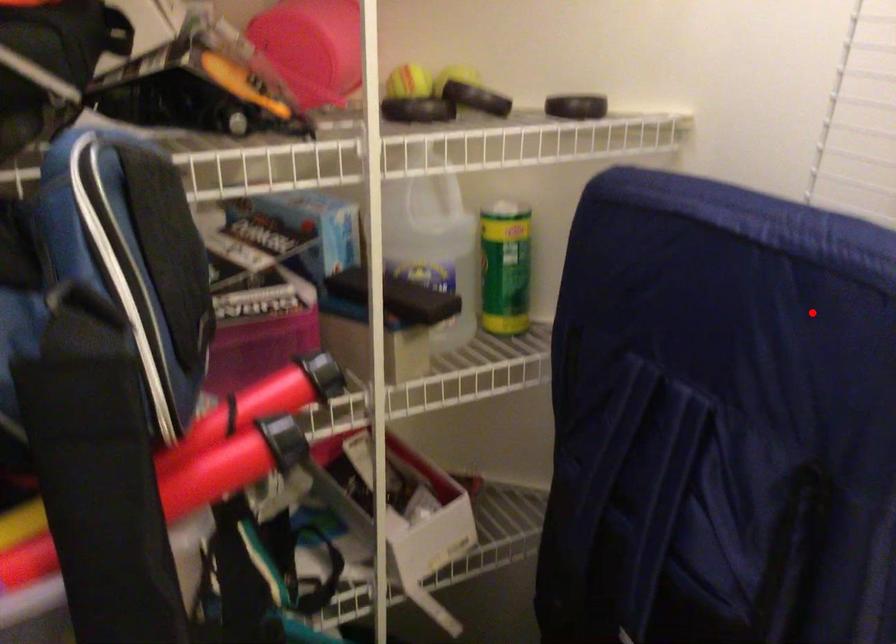
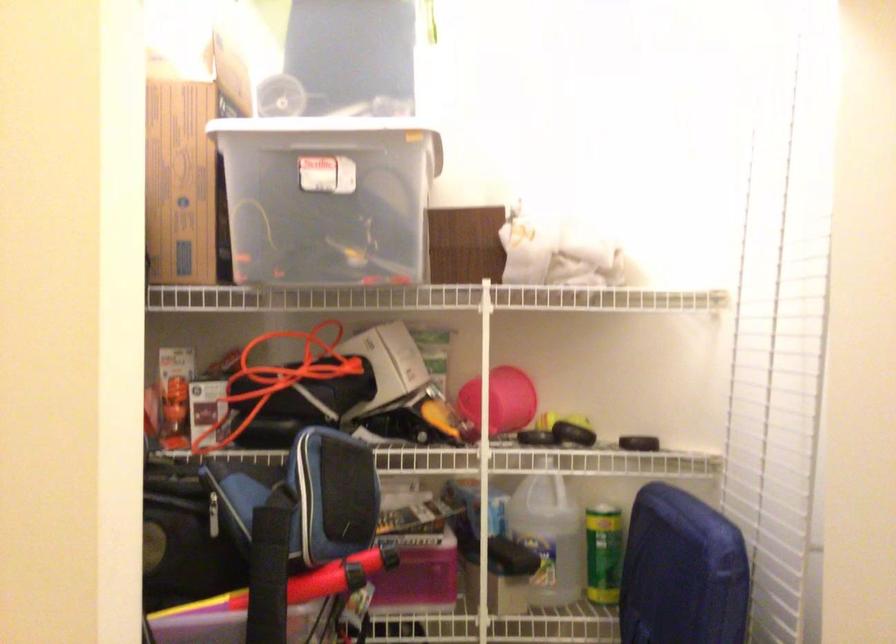
Question: I am providing you with two images of the same scene from different viewpoints. Given a red point in image1, look at the same physical point in image2. Is it:

Choices:
 (A) Closer to the viewpoint
 (B) Farther from the viewpoint

Answer: (B)